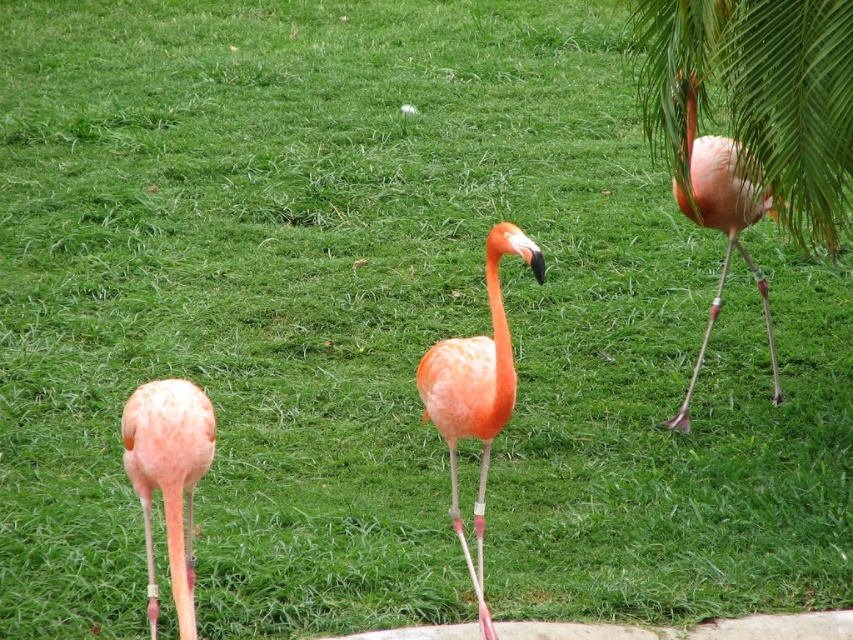
Question: Based on their relative distances, which object is nearer to the orange matte flamingo at center?

Choices:
 (A) pink feathered flamingo at upper right
 (B) pink matte flamingo at lower left
 (C) pink matte flamingo at upper right

Answer: (B)

Question: Is pink feathered flamingo at upper right closer to the viewer compared to orange matte flamingo at center?

Choices:
 (A) no
 (B) yes

Answer: (A)

Question: Is pink feathered flamingo at upper right above pink matte flamingo at lower left?

Choices:
 (A) yes
 (B) no

Answer: (A)

Question: Estimate the real-world distances between objects in this image. Which object is closer to the pink matte flamingo at upper right?

Choices:
 (A) orange matte flamingo at center
 (B) pink matte flamingo at lower left

Answer: (A)

Question: Does orange matte flamingo at center come behind pink matte flamingo at upper right?

Choices:
 (A) yes
 (B) no

Answer: (B)

Question: Which of the following is the closest to the observer?

Choices:
 (A) (840, 84)
 (B) (190, 547)
 (C) (712, 177)

Answer: (B)